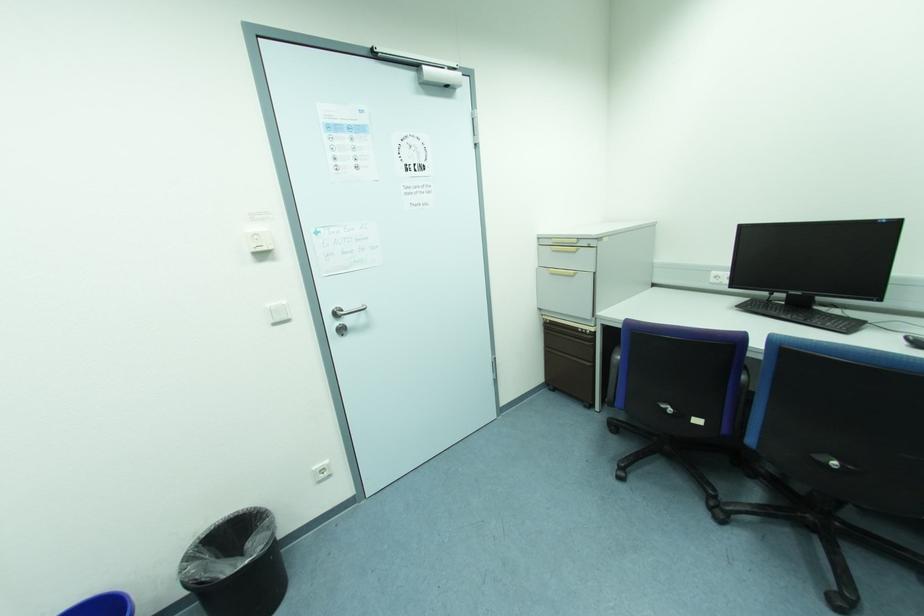
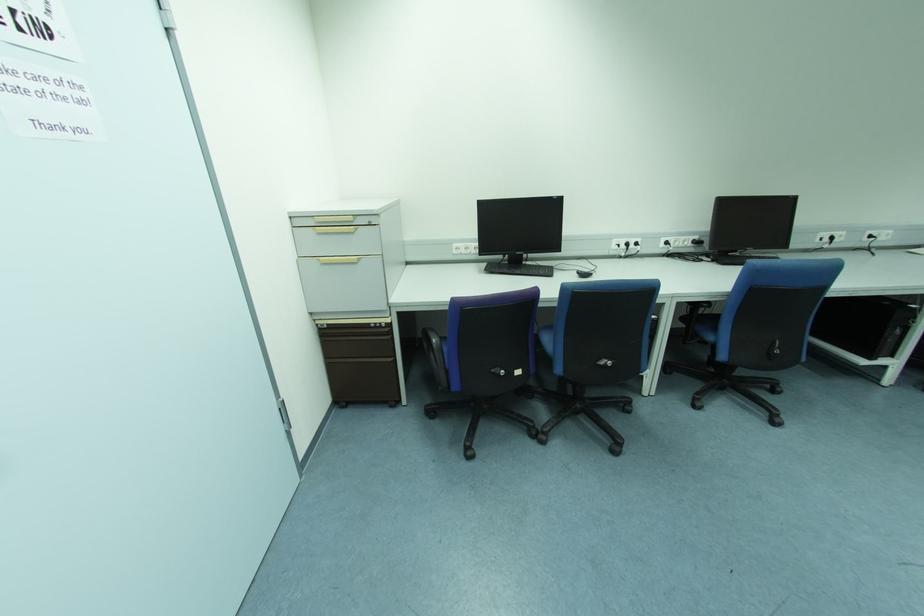
Where in the second image is the point corresponding to pixel 575 241 from the first image?

(350, 219)